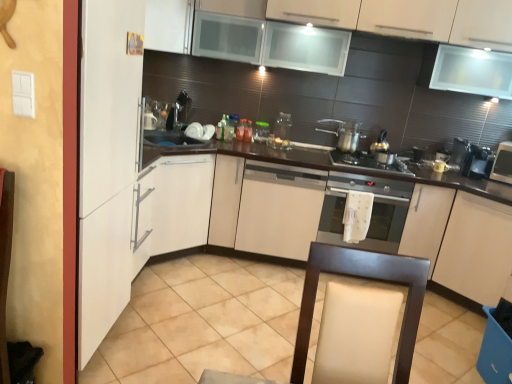
Question: Can you confirm if white matte cabinet at upper left, the fourth cabinetry from the bottom, is shorter than satin silver oven at center?

Choices:
 (A) no
 (B) yes

Answer: (B)

Question: Can you confirm if white matte cabinet at upper left, the fourth cabinetry from the bottom, is wider than satin silver oven at center?

Choices:
 (A) yes
 (B) no

Answer: (A)

Question: Is white matte cabinet at upper left, the fourth cabinetry from the bottom, bigger than satin silver oven at center?

Choices:
 (A) no
 (B) yes

Answer: (A)

Question: Could you tell me if white matte cabinet at upper left, the fourth cabinetry from the bottom, is turned towards satin silver oven at center?

Choices:
 (A) no
 (B) yes

Answer: (A)

Question: Would you say satin silver oven at center is part of white matte cabinet at upper left, the fourth cabinetry from the bottom,'s contents?

Choices:
 (A) yes
 (B) no

Answer: (B)

Question: Is clear plastic container at center, the third appliance viewed from the right, taller or shorter than white glossy bowl at upper center, arranged as the 1th appliance when viewed from the left?

Choices:
 (A) short
 (B) tall

Answer: (B)

Question: Based on their positions, is clear plastic container at center, which is the 3th appliance in left-to-right order, located to the left or right of white glossy bowl at upper center, which is the fifth appliance in right-to-left order?

Choices:
 (A) left
 (B) right

Answer: (B)

Question: In terms of size, does clear plastic container at center, which is the 3th appliance in left-to-right order, appear bigger or smaller than white glossy bowl at upper center, arranged as the 1th appliance when viewed from the left?

Choices:
 (A) big
 (B) small

Answer: (A)

Question: From the image's perspective, relative to white glossy bowl at upper center, which is the fifth appliance in right-to-left order, is clear plastic container at center, which is the 3th appliance in left-to-right order, above or below?

Choices:
 (A) above
 (B) below

Answer: (B)

Question: Would you say metallic silver gas stove at center is inside or outside satin silver oven at center?

Choices:
 (A) outside
 (B) inside

Answer: (A)

Question: Is metallic silver gas stove at center to the left or to the right of satin silver oven at center in the image?

Choices:
 (A) right
 (B) left

Answer: (A)

Question: Is metallic silver gas stove at center taller or shorter than satin silver oven at center?

Choices:
 (A) tall
 (B) short

Answer: (B)

Question: Looking at the image, does metallic silver gas stove at center seem bigger or smaller compared to satin silver oven at center?

Choices:
 (A) small
 (B) big

Answer: (A)

Question: From the image's perspective, is white matte cabinet at upper left, which is the first cabinetry in top-to-bottom order, above or below metallic silver coffee machine at right, placed as the 2th coffee machine when sorted from right to left?

Choices:
 (A) above
 (B) below

Answer: (A)

Question: Is point (152, 48) closer or farther from the camera than point (453, 144)?

Choices:
 (A) farther
 (B) closer

Answer: (B)